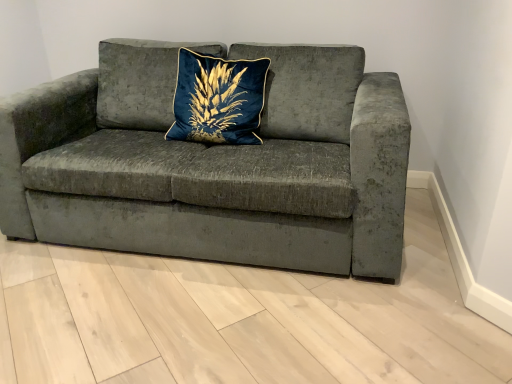
What do you see at coordinates (214, 163) in the screenshot? I see `velvet gray couch at center` at bounding box center [214, 163].

Image resolution: width=512 pixels, height=384 pixels. I want to click on velvet gray couch at center, so coord(214,163).

Find the location of a particular element. blue velvet pillow at center is located at coordinates (218, 99).

What do you see at coordinates (218, 99) in the screenshot? I see `blue velvet pillow at center` at bounding box center [218, 99].

What is the approximate height of blue velvet pillow at center?

It is 21.24 inches.

Locate an element on the screen. The height and width of the screenshot is (384, 512). velvet gray couch at center is located at coordinates 214,163.

Between velvet gray couch at center and blue velvet pillow at center, which one appears on the left side from the viewer's perspective?

velvet gray couch at center.

Relative to blue velvet pillow at center, is velvet gray couch at center in front or behind?

Clearly, velvet gray couch at center is in front of blue velvet pillow at center.

Is point (254, 58) positioned after point (265, 63)?

Yes, point (254, 58) is behind point (265, 63).

From the image's perspective, between velvet gray couch at center and blue velvet pillow at center, who is located below?

velvet gray couch at center, from the image's perspective.

From a real-world perspective, is velvet gray couch at center located higher than blue velvet pillow at center?

No, from a real-world perspective, velvet gray couch at center is not on top of blue velvet pillow at center.

Can you confirm if velvet gray couch at center is wider than blue velvet pillow at center?

Yes, velvet gray couch at center is wider than blue velvet pillow at center.

In terms of height, does velvet gray couch at center look taller or shorter compared to blue velvet pillow at center?

In the image, velvet gray couch at center appears to be taller than blue velvet pillow at center.

Which of these two, velvet gray couch at center or blue velvet pillow at center, is smaller?

blue velvet pillow at center is smaller.

Choose the correct answer: Is velvet gray couch at center inside blue velvet pillow at center or outside it?

velvet gray couch at center cannot be found inside blue velvet pillow at center.

Is velvet gray couch at center not near blue velvet pillow at center?

They are positioned close to each other.

Is velvet gray couch at center aimed at blue velvet pillow at center?

Yes.

At what (x,y) coordinates should I click in order to perform the action: click on studio couch on the left of the blue velvet pillow at center. Please return your answer as a coordinate pair (x, y). The width and height of the screenshot is (512, 384). Looking at the image, I should click on (214, 163).

Is blue velvet pillow at center at the right side of velvet gray couch at center?

Yes.

Which is behind, blue velvet pillow at center or velvet gray couch at center?

blue velvet pillow at center.

Is point (180, 52) positioned after point (157, 200)?

Yes, it is behind point (157, 200).

From the image's perspective, does blue velvet pillow at center appear lower than velvet gray couch at center?

No, from the image's perspective, blue velvet pillow at center is not below velvet gray couch at center.

From a real-world perspective, which is physically above, blue velvet pillow at center or velvet gray couch at center?

blue velvet pillow at center.

Is blue velvet pillow at center wider or thinner than velvet gray couch at center?

In the image, blue velvet pillow at center appears to be more narrow than velvet gray couch at center.

Considering the relative sizes of blue velvet pillow at center and velvet gray couch at center in the image provided, is blue velvet pillow at center taller than velvet gray couch at center?

No, blue velvet pillow at center is not taller than velvet gray couch at center.

Is blue velvet pillow at center smaller than velvet gray couch at center?

Yes, blue velvet pillow at center is smaller than velvet gray couch at center.

Is blue velvet pillow at center located outside velvet gray couch at center?

Actually, blue velvet pillow at center is within velvet gray couch at center.

Is there a large distance between blue velvet pillow at center and velvet gray couch at center?

blue velvet pillow at center is actually quite close to velvet gray couch at center.

Is blue velvet pillow at center looking in the opposite direction of velvet gray couch at center?

Correct, blue velvet pillow at center is looking away from velvet gray couch at center.

What's the angular difference between blue velvet pillow at center and velvet gray couch at center's facing directions?

6.34 degrees separate the facing orientations of blue velvet pillow at center and velvet gray couch at center.

At what (x,y) coordinates should I click in order to perform the action: click on studio couch that is on the left side of blue velvet pillow at center. Please return your answer as a coordinate pair (x, y). The width and height of the screenshot is (512, 384). Looking at the image, I should click on (214, 163).

Locate an element on the screen. The image size is (512, 384). studio couch on the left of blue velvet pillow at center is located at coordinates (214, 163).

This screenshot has height=384, width=512. Identify the location of pillow located behind the velvet gray couch at center. (218, 99).